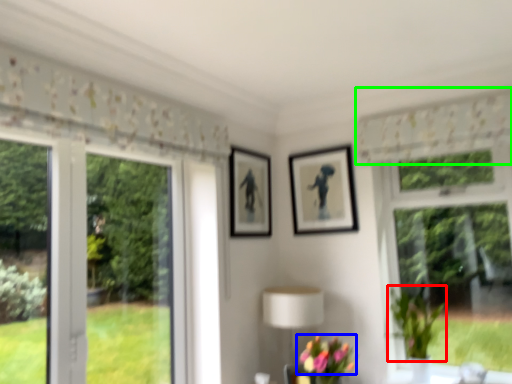
Question: Based on their relative distances, which object is nearer to plant (highlighted by a red box)? Choose from flower (highlighted by a blue box) and curtain (highlighted by a green box).

Choices:
 (A) flower
 (B) curtain

Answer: (A)